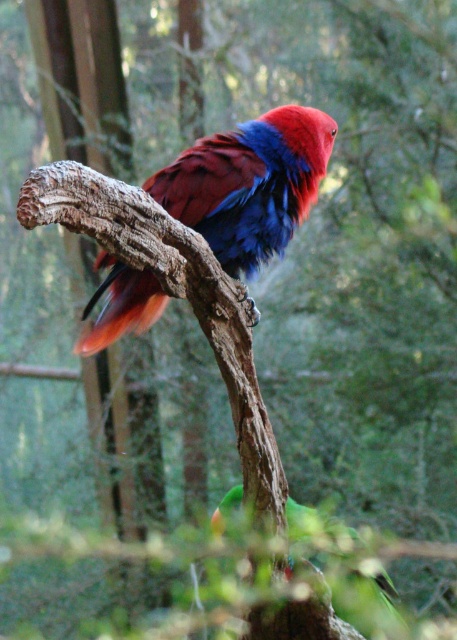
Does shiny multicolored parrot at center have a greater height compared to green matte parrot at lower center?

Correct, shiny multicolored parrot at center is much taller as green matte parrot at lower center.

Does shiny multicolored parrot at center appear over green matte parrot at lower center?

Indeed, shiny multicolored parrot at center is positioned over green matte parrot at lower center.

Identify the location of shiny multicolored parrot at center. (249, 184).